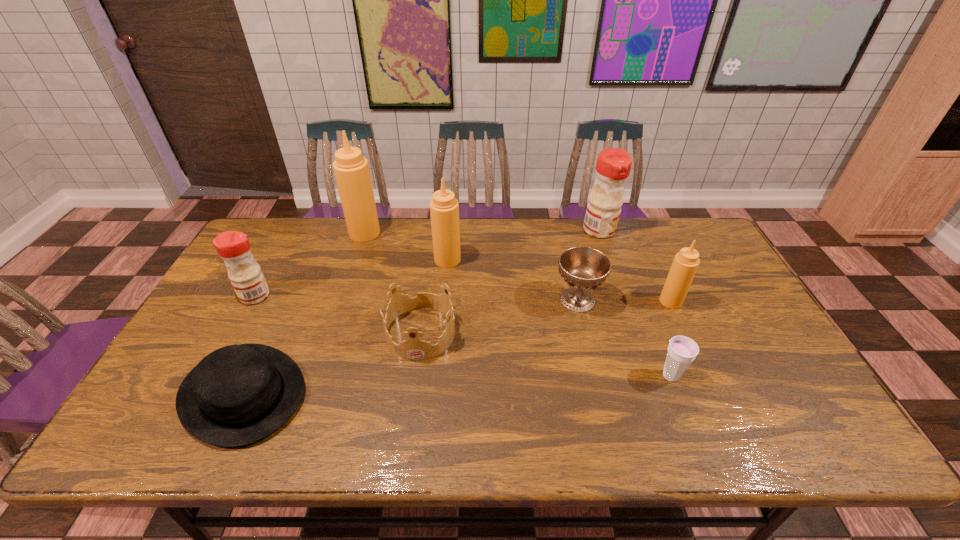
Locate an element on the screen. The height and width of the screenshot is (540, 960). the tallest condiment is located at coordinates (351, 169).

Locate an element on the screen. the fourth condiment from right to left is located at coordinates (351, 169).

The width and height of the screenshot is (960, 540). Identify the location of the second condiment from right to left. (613, 166).

This screenshot has width=960, height=540. What are the coordinates of `the farther red condiment` in the screenshot? It's located at (613, 166).

Where is `the third farthest condiment`? the third farthest condiment is located at coordinates (444, 208).

I want to click on the second farthest tan condiment, so click(444, 208).

Where is `the nearest tan condiment`? This screenshot has height=540, width=960. the nearest tan condiment is located at coordinates (685, 264).

Find the location of a particular element. The width and height of the screenshot is (960, 540). the rightmost tan condiment is located at coordinates (685, 264).

The image size is (960, 540). In order to click on the leftmost condiment in this screenshot , I will do `click(248, 281)`.

This screenshot has width=960, height=540. In order to click on the smaller red condiment in this screenshot , I will do `click(248, 281)`.